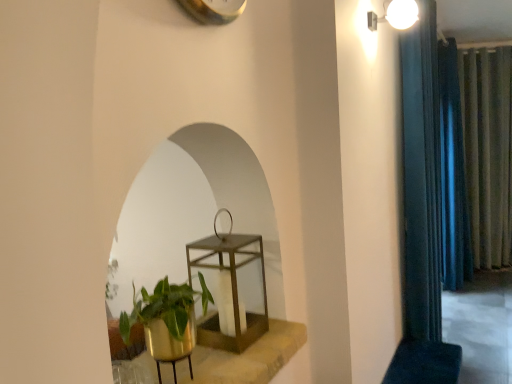
Question: Can you confirm if blue velvet curtain at right, which is counted as the 3th curtain, starting from the right, is thinner than gold metallic plant pot at lower left?

Choices:
 (A) no
 (B) yes

Answer: (B)

Question: Is the position of blue velvet curtain at right, which appears as the third curtain when viewed from the back, less distant than that of gold metallic plant pot at lower left?

Choices:
 (A) no
 (B) yes

Answer: (A)

Question: Is blue velvet curtain at right, which is counted as the 3th curtain, starting from the right, to the left of gold metallic plant pot at lower left from the viewer's perspective?

Choices:
 (A) no
 (B) yes

Answer: (A)

Question: From the image's perspective, is blue velvet curtain at right, the first curtain in the front-to-back sequence, located above gold metallic plant pot at lower left?

Choices:
 (A) yes
 (B) no

Answer: (A)

Question: Is blue velvet curtain at right, which is counted as the 3th curtain, starting from the right, far away from gold metallic plant pot at lower left?

Choices:
 (A) yes
 (B) no

Answer: (A)

Question: Considering the positions of point (251, 334) and point (373, 14), is point (251, 334) closer or farther from the camera than point (373, 14)?

Choices:
 (A) closer
 (B) farther

Answer: (A)

Question: Relative to white glossy light fixture at upper right, is metallic gold lantern at center in front or behind?

Choices:
 (A) behind
 (B) front

Answer: (B)

Question: Is metallic gold lantern at center taller or shorter than white glossy light fixture at upper right?

Choices:
 (A) short
 (B) tall

Answer: (B)

Question: Looking at their shapes, would you say metallic gold lantern at center is wider or thinner than white glossy light fixture at upper right?

Choices:
 (A) thin
 (B) wide

Answer: (A)

Question: From a real-world perspective, is gold metallic plant pot at lower left above or below blue velvet curtain at right, which appears as the third curtain when viewed from the back?

Choices:
 (A) above
 (B) below

Answer: (B)

Question: Considering the positions of gold metallic plant pot at lower left and blue velvet curtain at right, the first curtain in the front-to-back sequence, in the image, is gold metallic plant pot at lower left wider or thinner than blue velvet curtain at right, the first curtain in the front-to-back sequence,?

Choices:
 (A) wide
 (B) thin

Answer: (A)

Question: Is point (284, 350) closer or farther from the camera than point (431, 185)?

Choices:
 (A) farther
 (B) closer

Answer: (B)

Question: Would you say gold metallic plant pot at lower left is inside or outside blue velvet curtain at right, which is counted as the 3th curtain, starting from the right?

Choices:
 (A) inside
 (B) outside

Answer: (B)

Question: From the image's perspective, is dark blue fabric curtain at right, which appears as the 2th curtain when viewed from the right, above or below gold metallic plant pot at lower left?

Choices:
 (A) above
 (B) below

Answer: (A)

Question: Considering the positions of dark blue fabric curtain at right, the 2th curtain viewed from the left, and gold metallic plant pot at lower left in the image, is dark blue fabric curtain at right, the 2th curtain viewed from the left, taller or shorter than gold metallic plant pot at lower left?

Choices:
 (A) short
 (B) tall

Answer: (B)